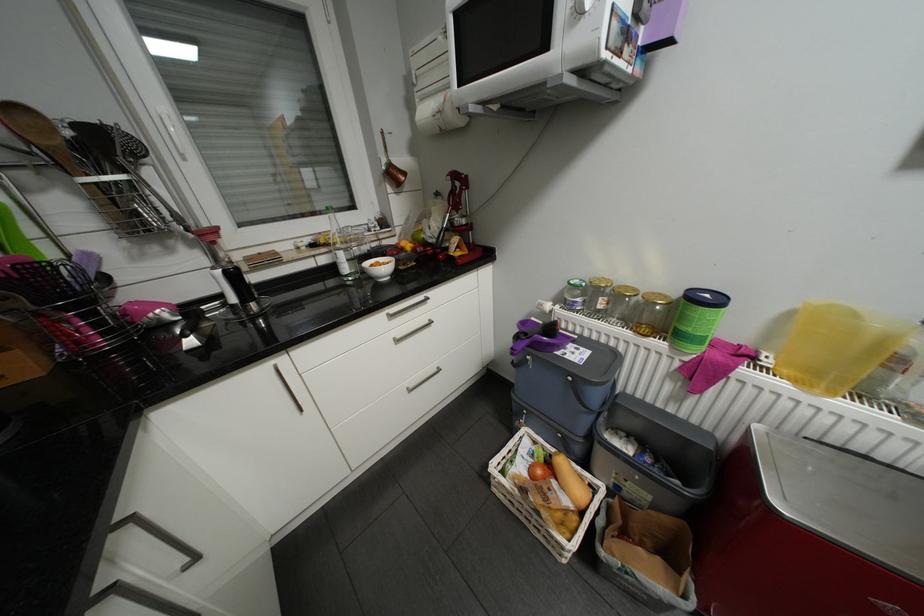
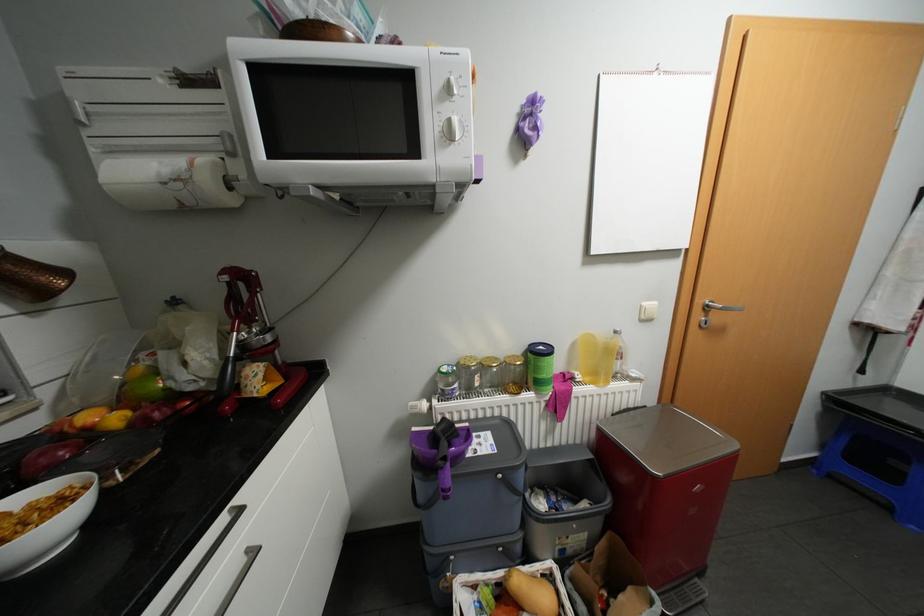
Locate, in the second image, the point that corresponds to (391,267) in the first image.

(44, 522)